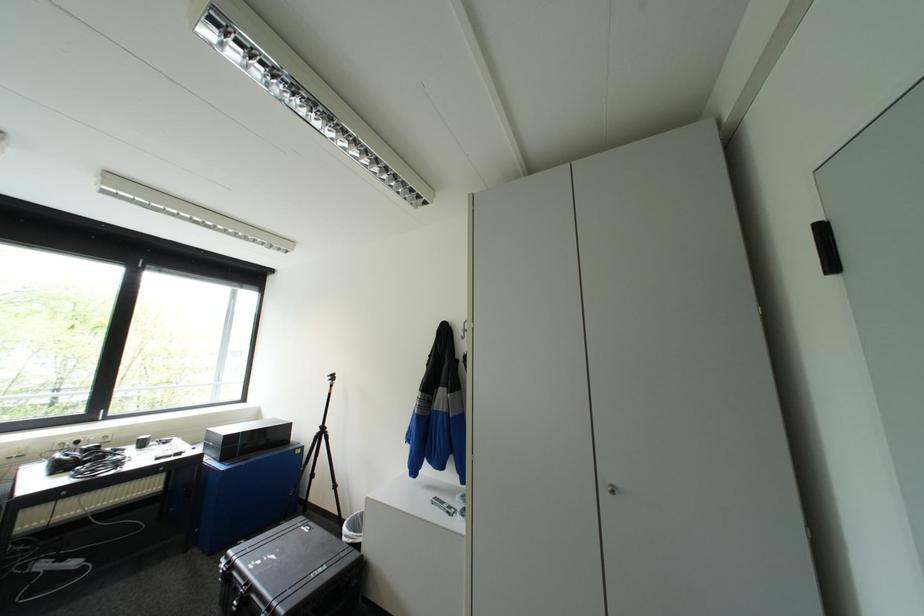
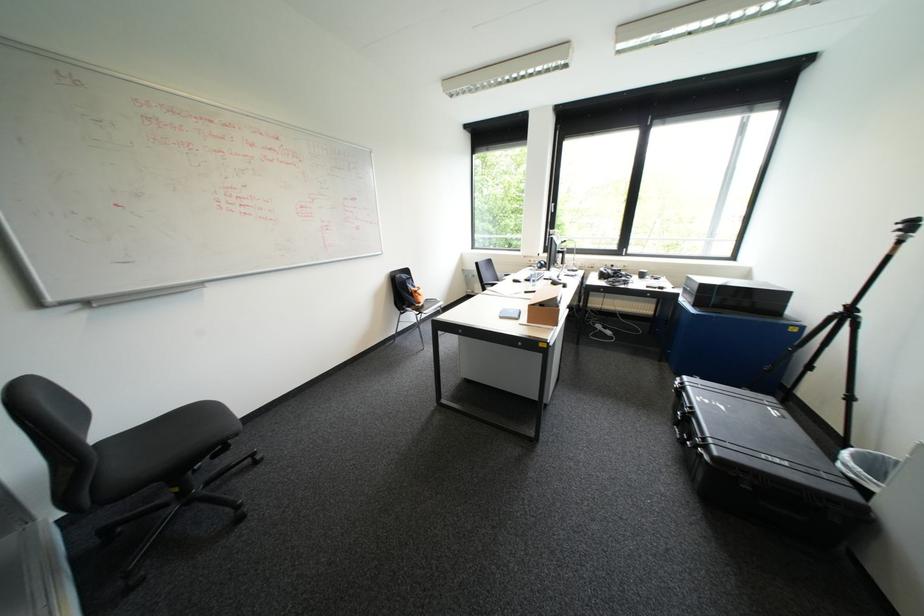
Where in the second image is the point corresponding to (362,533) from the first image?

(873, 472)